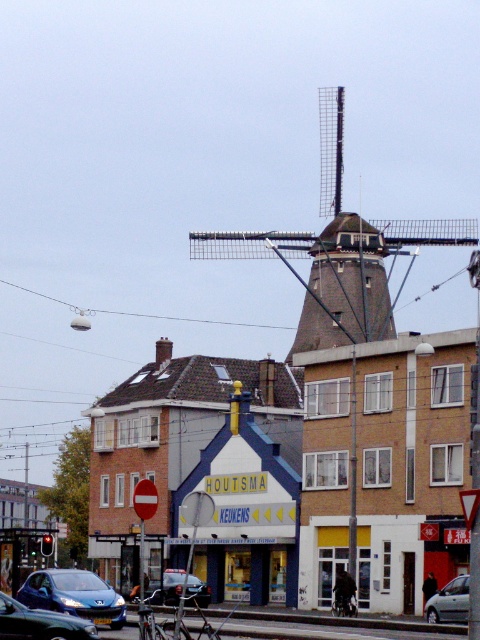
Which of these two, brown brick windmill at center or silver metallic car at lower right, stands shorter?

silver metallic car at lower right is shorter.

Is brown brick windmill at center taller than silver metallic car at lower right?

Indeed, brown brick windmill at center has a greater height compared to silver metallic car at lower right.

Does point (264, 256) lie in front of point (459, 608)?

No, it is behind (459, 608).

The image size is (480, 640). Find the location of `brown brick windmill at center`. brown brick windmill at center is located at coordinates (337, 250).

Between brown brick windmill at center and shiny blue sedan at lower left, which one has more height?

With more height is brown brick windmill at center.

Describe the element at coordinates (337, 250) in the screenshot. I see `brown brick windmill at center` at that location.

Who is more forward, (334, 342) or (25, 620)?

Point (25, 620) is more forward.

Locate an element on the screen. brown brick windmill at center is located at coordinates (337, 250).

Who is more distant from viewer, (x=72, y=570) or (x=172, y=592)?

The point (x=172, y=592) is behind.

Is blue metallic hatchback at lower left taller than metallic silver car at center?

In fact, blue metallic hatchback at lower left may be shorter than metallic silver car at center.

Find the location of a particular element. Image resolution: width=480 pixels, height=640 pixels. blue metallic hatchback at lower left is located at coordinates (73, 595).